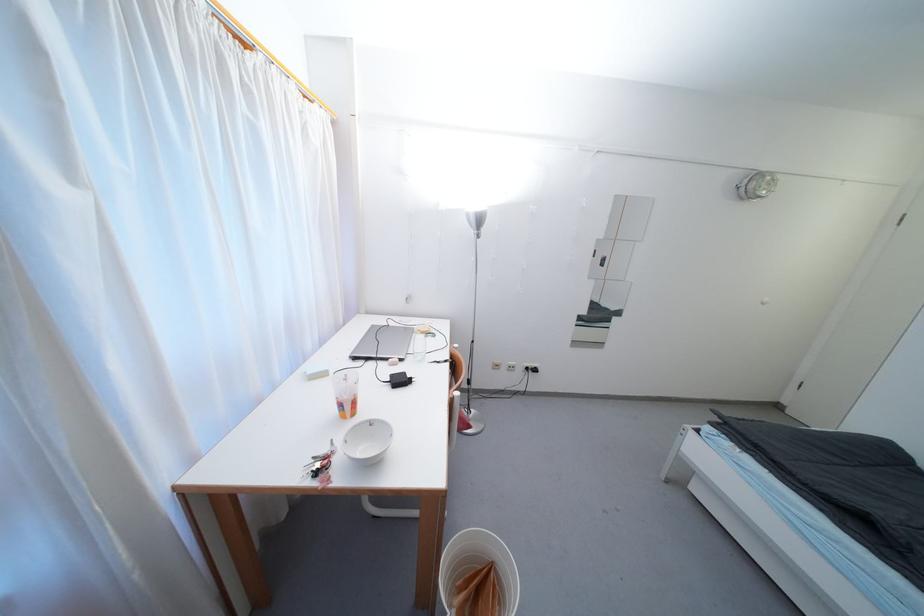
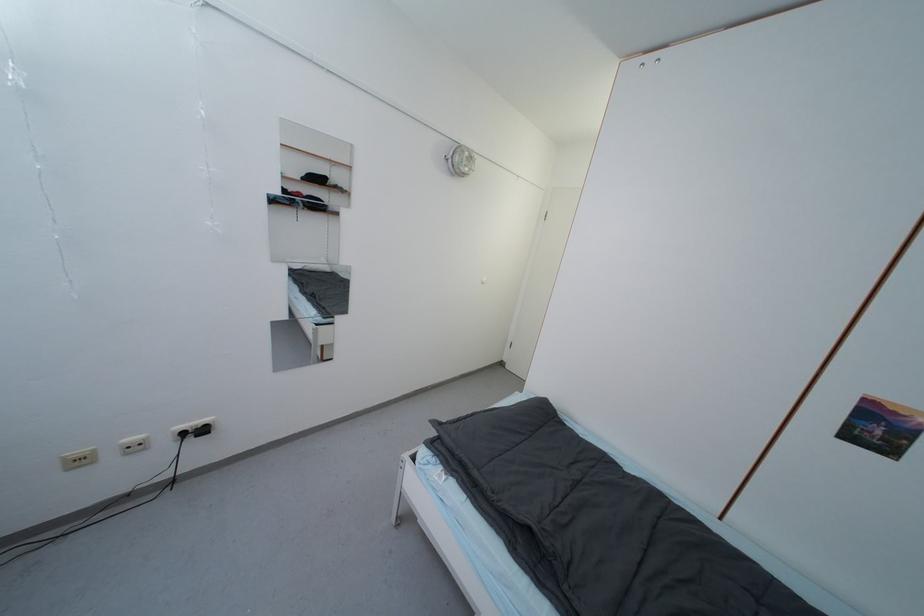
The point at (516, 371) is marked in the first image. Where is the corresponding point in the second image?

(140, 450)